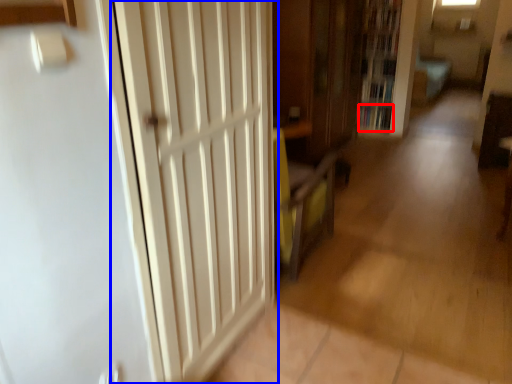
Question: Which point is further to the camera, book (highlighted by a red box) or door (highlighted by a blue box)?

Choices:
 (A) book
 (B) door

Answer: (A)